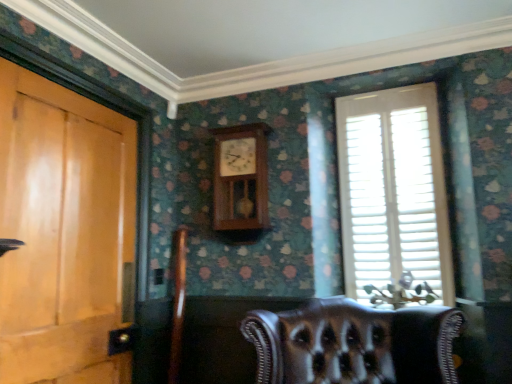
Question: Are leather chair at lower center and light brown wood door at left far apart?

Choices:
 (A) no
 (B) yes

Answer: (B)

Question: Can you confirm if leather chair at lower center is taller than light brown wood door at left?

Choices:
 (A) yes
 (B) no

Answer: (B)

Question: Is leather chair at lower center oriented towards light brown wood door at left?

Choices:
 (A) no
 (B) yes

Answer: (A)

Question: Considering the relative sizes of leather chair at lower center and light brown wood door at left in the image provided, is leather chair at lower center shorter than light brown wood door at left?

Choices:
 (A) no
 (B) yes

Answer: (B)

Question: From a real-world perspective, is leather chair at lower center located beneath light brown wood door at left?

Choices:
 (A) yes
 (B) no

Answer: (A)

Question: Does point click(396, 117) appear closer or farther from the camera than point click(245, 170)?

Choices:
 (A) farther
 (B) closer

Answer: (A)

Question: From a real-world perspective, is white wood blinds at right above or below wooden clock at center?

Choices:
 (A) above
 (B) below

Answer: (B)

Question: Considering the positions of white wood blinds at right and wooden clock at center in the image, is white wood blinds at right bigger or smaller than wooden clock at center?

Choices:
 (A) big
 (B) small

Answer: (A)

Question: Is white wood blinds at right to the left or to the right of wooden clock at center in the image?

Choices:
 (A) right
 (B) left

Answer: (A)

Question: Considering the relative positions of light brown wood door at left and white wood blinds at right in the image provided, is light brown wood door at left to the left or to the right of white wood blinds at right?

Choices:
 (A) right
 (B) left

Answer: (B)

Question: Is light brown wood door at left bigger or smaller than white wood blinds at right?

Choices:
 (A) small
 (B) big

Answer: (B)

Question: Is light brown wood door at left situated inside white wood blinds at right or outside?

Choices:
 (A) inside
 (B) outside

Answer: (B)

Question: Is light brown wood door at left in front of or behind white wood blinds at right in the image?

Choices:
 (A) behind
 (B) front

Answer: (B)

Question: From a real-world perspective, relative to light brown wood door at left, is white wood blinds at right vertically above or below?

Choices:
 (A) above
 (B) below

Answer: (A)

Question: In the image, is white wood blinds at right on the left side or the right side of light brown wood door at left?

Choices:
 (A) left
 (B) right

Answer: (B)